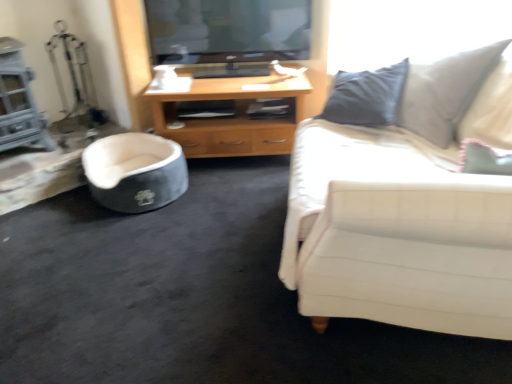
Find the location of `wooden cabinet at center`. wooden cabinet at center is located at coordinates (232, 116).

Is soft gray fabric pet bed at lower left inside the boundaries of wooden cabinet at center, or outside?

soft gray fabric pet bed at lower left is spatially situated outside wooden cabinet at center.

Considering the sizes of objects soft gray fabric pet bed at lower left and wooden cabinet at center in the image provided, who is taller, soft gray fabric pet bed at lower left or wooden cabinet at center?

Standing taller between the two is wooden cabinet at center.

Are soft gray fabric pet bed at lower left and wooden cabinet at center beside each other?

No, soft gray fabric pet bed at lower left is not making contact with wooden cabinet at center.

From the image's perspective, does soft gray fabric pet bed at lower left appear higher than wooden cabinet at center?

No, from the image's perspective, soft gray fabric pet bed at lower left is not above wooden cabinet at center.

Is there a large distance between white fabric couch at right and soft gray fabric pet bed at lower left?

white fabric couch at right is positioned a significant distance from soft gray fabric pet bed at lower left.

From a real-world perspective, is white fabric couch at right above or below soft gray fabric pet bed at lower left?

From a real-world perspective, white fabric couch at right is physically above soft gray fabric pet bed at lower left.

In terms of width, does white fabric couch at right look wider or thinner when compared to soft gray fabric pet bed at lower left?

Considering their sizes, white fabric couch at right looks broader than soft gray fabric pet bed at lower left.

Where is `studio couch in front of the soft gray fabric pet bed at lower left`? Image resolution: width=512 pixels, height=384 pixels. studio couch in front of the soft gray fabric pet bed at lower left is located at coordinates (396, 231).

Who is smaller, wooden cabinet at center or white fabric couch at right?

With smaller size is wooden cabinet at center.

Based on the photo, can you confirm if wooden cabinet at center is positioned to the right of white fabric couch at right?

In fact, wooden cabinet at center is to the left of white fabric couch at right.

Is point (239, 141) positioned before point (486, 97)?

No, it is behind (486, 97).

Choose the correct answer: Is wooden cabinet at center inside soft gray fabric pet bed at lower left or outside it?

wooden cabinet at center is spatially situated outside soft gray fabric pet bed at lower left.

What's the angular difference between wooden cabinet at center and soft gray fabric pet bed at lower left's facing directions?

The angle between the facing direction of wooden cabinet at center and the facing direction of soft gray fabric pet bed at lower left is 40.4 degrees.

In terms of size, does wooden cabinet at center appear bigger or smaller than soft gray fabric pet bed at lower left?

Considering their sizes, wooden cabinet at center takes up more space than soft gray fabric pet bed at lower left.

Does point (170, 160) come behind point (347, 257)?

Yes, point (170, 160) is behind point (347, 257).

This screenshot has height=384, width=512. What are the coordinates of `studio couch above the soft gray fabric pet bed at lower left (from a real-world perspective)` in the screenshot? It's located at (396, 231).

In the scene shown: Is soft gray fabric pet bed at lower left spatially inside white fabric couch at right, or outside of it?

soft gray fabric pet bed at lower left is not inside white fabric couch at right, it's outside.

Is soft gray fabric pet bed at lower left positioned with its back to white fabric couch at right?

No, soft gray fabric pet bed at lower left's orientation is not away from white fabric couch at right.

Considering the sizes of objects white fabric couch at right and wooden cabinet at center in the image provided, who is shorter, white fabric couch at right or wooden cabinet at center?

With less height is wooden cabinet at center.

From a real-world perspective, relative to wooden cabinet at center, is white fabric couch at right vertically above or below?

white fabric couch at right is situated higher than wooden cabinet at center in the real world.

Is wooden cabinet at center at the back of white fabric couch at right?

white fabric couch at right is not turned away from wooden cabinet at center.

In the image, there is a wooden cabinet at center. Where is `chair below it (from a real-world perspective)`? Image resolution: width=512 pixels, height=384 pixels. chair below it (from a real-world perspective) is located at coordinates (135, 172).

This screenshot has width=512, height=384. In order to click on chair on the left side of white fabric couch at right in this screenshot , I will do `click(135, 172)`.

From the image, which object appears to be nearer to soft gray fabric pet bed at lower left, white fabric couch at right or wooden cabinet at center?

wooden cabinet at center lies closer to soft gray fabric pet bed at lower left than the other object.

Looking at the image, which one is located further to white fabric couch at right, wooden cabinet at center or soft gray fabric pet bed at lower left?

soft gray fabric pet bed at lower left is further to white fabric couch at right.

Estimate the real-world distances between objects in this image. Which object is closer to wooden cabinet at center, white fabric couch at right or soft gray fabric pet bed at lower left?

soft gray fabric pet bed at lower left is closer to wooden cabinet at center.

Estimate the real-world distances between objects in this image. Which object is closer to white fabric couch at right, soft gray fabric pet bed at lower left or wooden cabinet at center?

wooden cabinet at center lies closer to white fabric couch at right than the other object.

Estimate the real-world distances between objects in this image. Which object is closer to soft gray fabric pet bed at lower left, wooden cabinet at center or white fabric couch at right?

wooden cabinet at center lies closer to soft gray fabric pet bed at lower left than the other object.

When comparing their distances from wooden cabinet at center, does soft gray fabric pet bed at lower left or white fabric couch at right seem closer?

soft gray fabric pet bed at lower left is positioned closer to the anchor wooden cabinet at center.

Image resolution: width=512 pixels, height=384 pixels. Identify the location of chair between white fabric couch at right and wooden cabinet at center in the front-back direction. (135, 172).